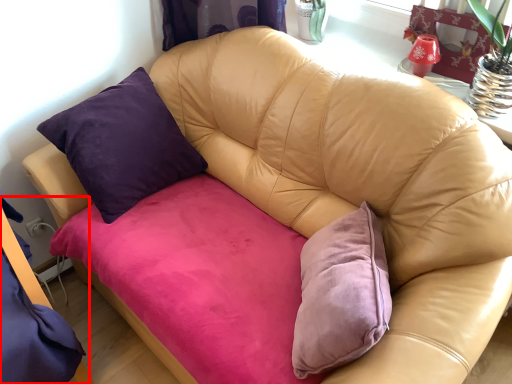
Question: From the image, what is the correct spatial relationship of bed frame (annotated by the red box) in relation to swivel chair?

Choices:
 (A) right
 (B) left

Answer: (B)